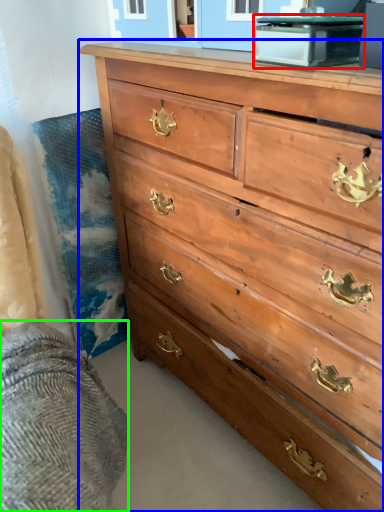
Question: Which object is positioned farthest from cabinetry (highlighted by a red box)? Select from chest of drawers (highlighted by a blue box) and bedding (highlighted by a green box).

Choices:
 (A) chest of drawers
 (B) bedding

Answer: (B)